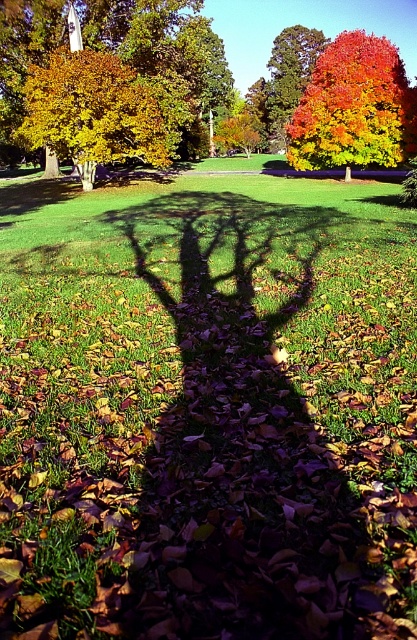
You are standing in the autumn park scene. You see the vivid orange maple at upper right and the golden yellow leaves at upper left. Which one is positioned more to the right side of the image?

The vivid orange maple at upper right is positioned more to the right side of the image than the golden yellow leaves at upper left.

You are standing in the autumn park scene. There is a point marked at coordinates (117, 49). What object is located at this point?

The point at coordinates (117, 49) corresponds to orange autumn leaves at center.